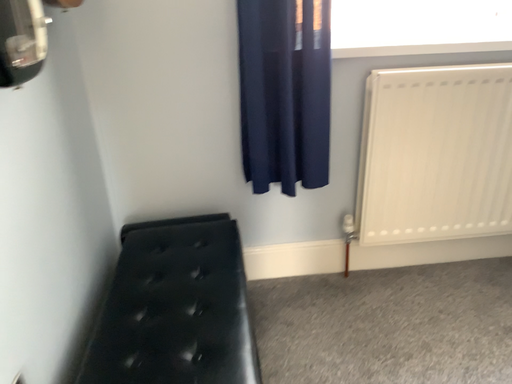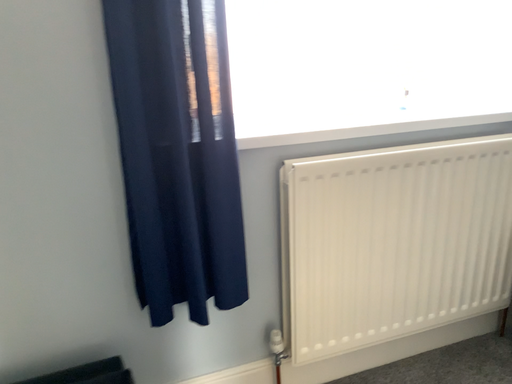
Question: Which way did the camera rotate in the video?

Choices:
 (A) rotated downward
 (B) rotated upward

Answer: (B)